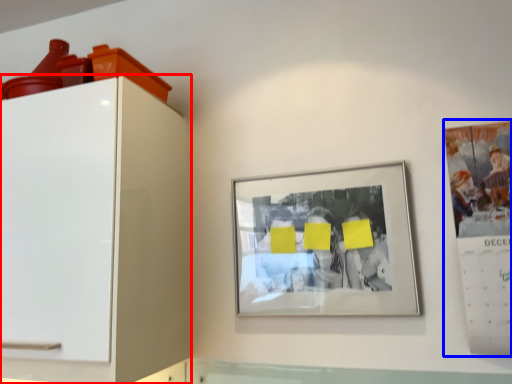
Question: Which point is closer to the camera, furniture (highlighted by a red box) or poster (highlighted by a blue box)?

Choices:
 (A) furniture
 (B) poster

Answer: (A)